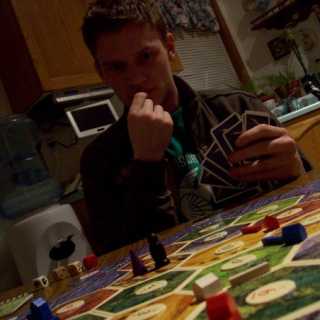
This screenshot has height=320, width=320. Find the location of `cabinet`. cabinet is located at coordinates (64, 64).